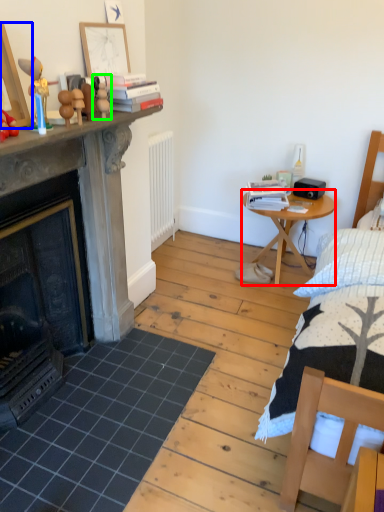
Question: Which object is the closest to the nightstand (highlighted by a red box)? Choose among these: picture frame (highlighted by a blue box) or toy (highlighted by a green box).

Choices:
 (A) picture frame
 (B) toy

Answer: (B)